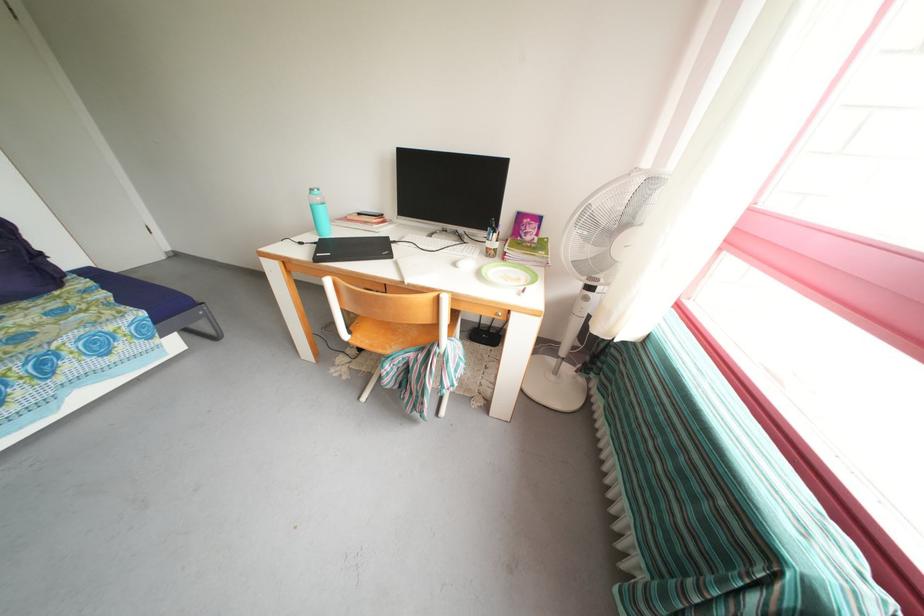
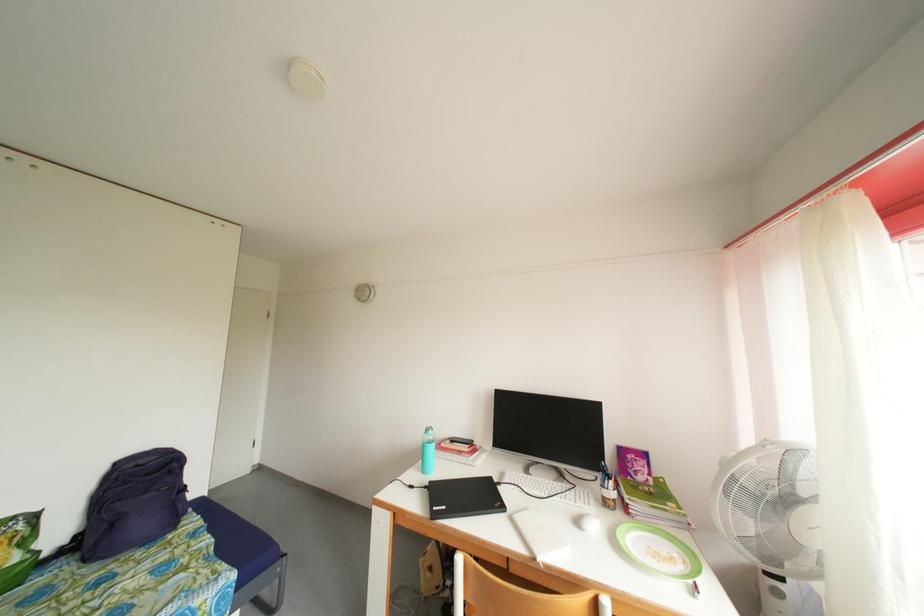
In the second image, find the point that corresponds to [319,196] in the first image.

(434, 436)